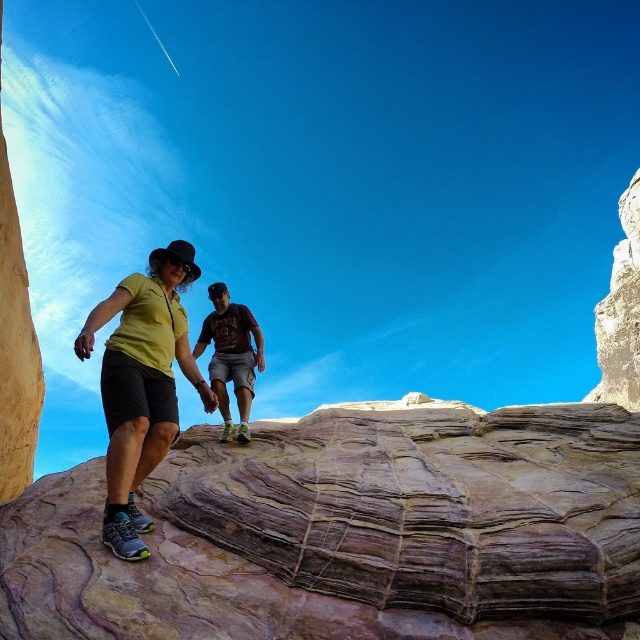
Question: Which point is farther to the camera?

Choices:
 (A) (221, 496)
 (B) (160, 381)

Answer: (B)

Question: Estimate the real-world distances between objects in this image. Which object is farther from the matte yellow shirt at center?

Choices:
 (A) rustic stone rock at center
 (B) matte brown t-shirt at center

Answer: (B)

Question: Is rustic stone rock at center bigger than matte brown t-shirt at center?

Choices:
 (A) yes
 (B) no

Answer: (A)

Question: Does rustic stone rock at center lie behind matte yellow shirt at center?

Choices:
 (A) no
 (B) yes

Answer: (A)

Question: Which object appears farthest from the camera in this image?

Choices:
 (A) matte yellow shirt at center
 (B) rustic stone rock at center

Answer: (A)

Question: Is rustic stone rock at center to the left of matte yellow shirt at center from the viewer's perspective?

Choices:
 (A) yes
 (B) no

Answer: (B)